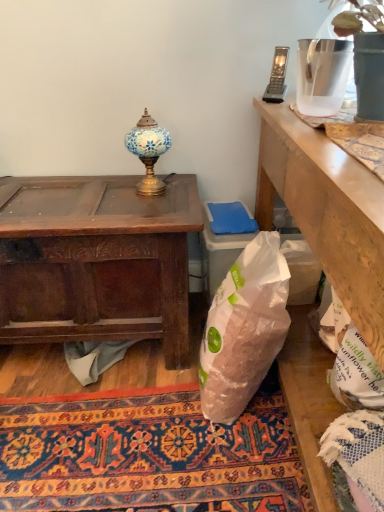
Question: Is carpeted rug at center inside or outside of dark brown wood desk at left?

Choices:
 (A) outside
 (B) inside

Answer: (A)

Question: Considering the positions of carpeted rug at center and dark brown wood desk at left in the image, is carpeted rug at center taller or shorter than dark brown wood desk at left?

Choices:
 (A) tall
 (B) short

Answer: (B)

Question: Which is farther from the clear plastic pitcher at upper right?

Choices:
 (A) dark brown wood desk at left
 (B) translucent plastic vase at upper right
 (C) gray fabric at lower center
 (D) mosaic glass lamp at upper center
 (E) translucent plastic bag at center

Answer: (C)

Question: Which of these objects is positioned farthest from the carpeted rug at center?

Choices:
 (A) dark brown wood desk at left
 (B) translucent plastic bag at center
 (C) mosaic glass lamp at upper center
 (D) translucent plastic vase at upper right
 (E) clear plastic pitcher at upper right

Answer: (D)